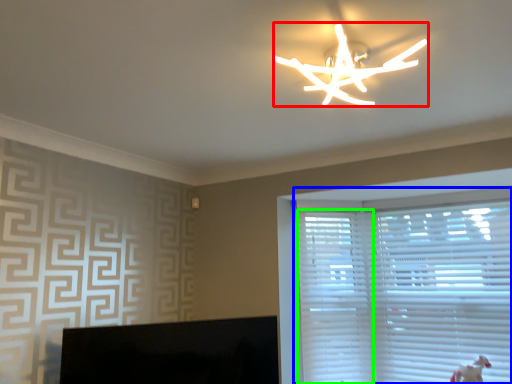
Question: Based on their relative distances, which object is nearer to lamp (highlighted by a red box)? Choose from window blind (highlighted by a blue box) and blind (highlighted by a green box).

Choices:
 (A) window blind
 (B) blind

Answer: (A)